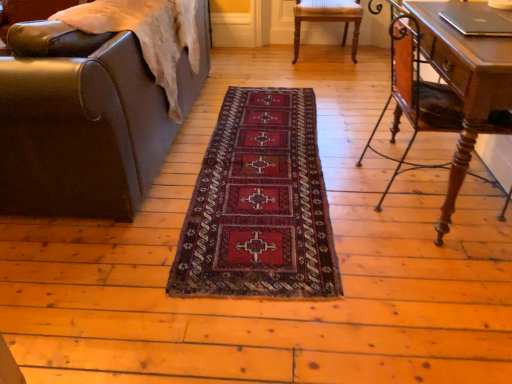
Question: Can you confirm if dark red woven rug at center is shorter than leather at left, marked as the second chair in a back-to-front arrangement?

Choices:
 (A) yes
 (B) no

Answer: (A)

Question: From a real-world perspective, is dark red woven rug at center located beneath leather at left, which is the 1th chair from left to right?

Choices:
 (A) no
 (B) yes

Answer: (B)

Question: From the image's perspective, is dark red woven rug at center above leather at left, arranged as the 2th chair when viewed from the right?

Choices:
 (A) no
 (B) yes

Answer: (A)

Question: Is dark red woven rug at center not close to leather at left, arranged as the first chair when viewed from the front?

Choices:
 (A) no
 (B) yes

Answer: (A)

Question: Is dark red woven rug at center located outside leather at left, arranged as the 2th chair when viewed from the right?

Choices:
 (A) yes
 (B) no

Answer: (A)

Question: Does point (296, 3) appear closer or farther from the camera than point (290, 187)?

Choices:
 (A) closer
 (B) farther

Answer: (B)

Question: From the image's perspective, is wooden chair at center, marked as the 2th chair in a left-to-right arrangement, located above or below dark red woven rug at center?

Choices:
 (A) below
 (B) above

Answer: (B)

Question: From a real-world perspective, is wooden chair at center, which is the 1th chair from right to left, physically located above or below dark red woven rug at center?

Choices:
 (A) below
 (B) above

Answer: (B)

Question: Would you say wooden chair at center, which appears as the 2th chair when viewed from the front, is to the left or to the right of dark red woven rug at center in the picture?

Choices:
 (A) left
 (B) right

Answer: (B)

Question: Does point (395, 119) appear closer or farther from the camera than point (352, 36)?

Choices:
 (A) farther
 (B) closer

Answer: (B)

Question: From a real-world perspective, is wooden desk at right above or below wooden chair at center, which appears as the 1th chair when viewed from the back?

Choices:
 (A) above
 (B) below

Answer: (A)

Question: Would you say wooden desk at right is to the left or to the right of wooden chair at center, which appears as the 2th chair when viewed from the front, in the picture?

Choices:
 (A) left
 (B) right

Answer: (B)

Question: Considering their positions, is wooden desk at right located in front of or behind wooden chair at center, which appears as the 2th chair when viewed from the front?

Choices:
 (A) front
 (B) behind

Answer: (A)

Question: Based on their positions, is wooden desk at right located to the left or right of leather at left, arranged as the 2th chair when viewed from the right?

Choices:
 (A) left
 (B) right

Answer: (B)

Question: From a real-world perspective, is wooden desk at right physically located above or below leather at left, marked as the second chair in a back-to-front arrangement?

Choices:
 (A) above
 (B) below

Answer: (B)